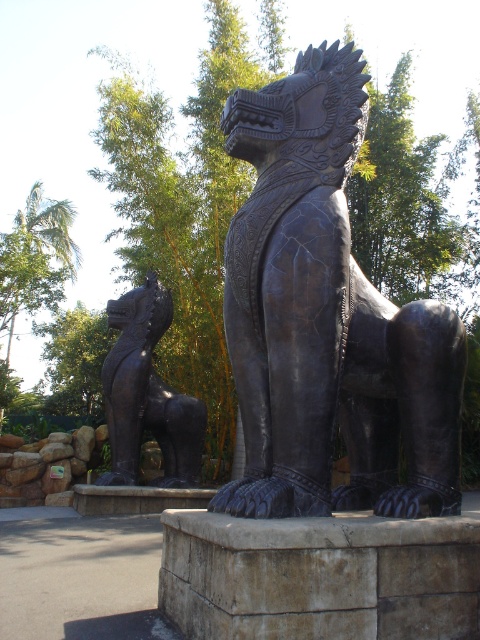
You are standing in front of the two statues. The bronze textured lion at center is at point (326, 320). Where is the other statue located relative to the bronze textured lion at center?

The other statue is positioned slightly behind and to the left of the bronze textured lion at center.

You are an art curator planning to display both the bronze textured lion at center and the bronze statue at center in a gallery. Given their heights, which one should be placed on a higher pedestal to ensure they appear balanced in the exhibition layout?

The bronze textured lion at center has a lesser height compared to the bronze statue at center, so placing it on a higher pedestal would balance their overall visual heights in the exhibition layout.

You are standing in front of the statues and want to take a photo of the bronze textured lion at center. To ensure it is centered in your camera frame, where should you aim your camera? Please provide coordinates based on the image grid system where the bottom left corner is the origin point.

The bronze textured lion at center is located at coordinates 0.500 on the x axis and 0.681 on the y axis, so aim your camera at those coordinates to center it in the frame.